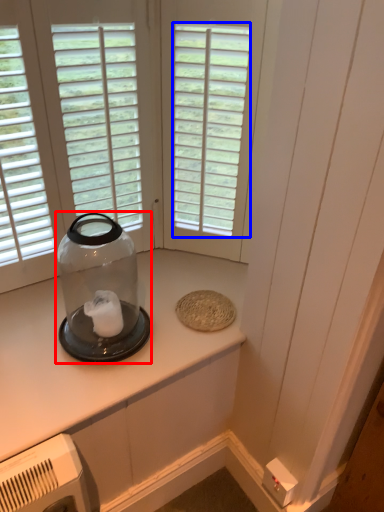
Question: Among these objects, which one is nearest to the camera, glass bottle (highlighted by a red box) or window (highlighted by a blue box)?

Choices:
 (A) glass bottle
 (B) window

Answer: (A)